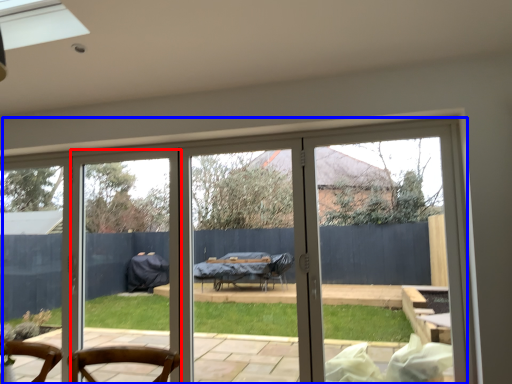
Question: Which of the following is the farthest to the observer, screen door (highlighted by a red box) or door (highlighted by a blue box)?

Choices:
 (A) screen door
 (B) door

Answer: (A)